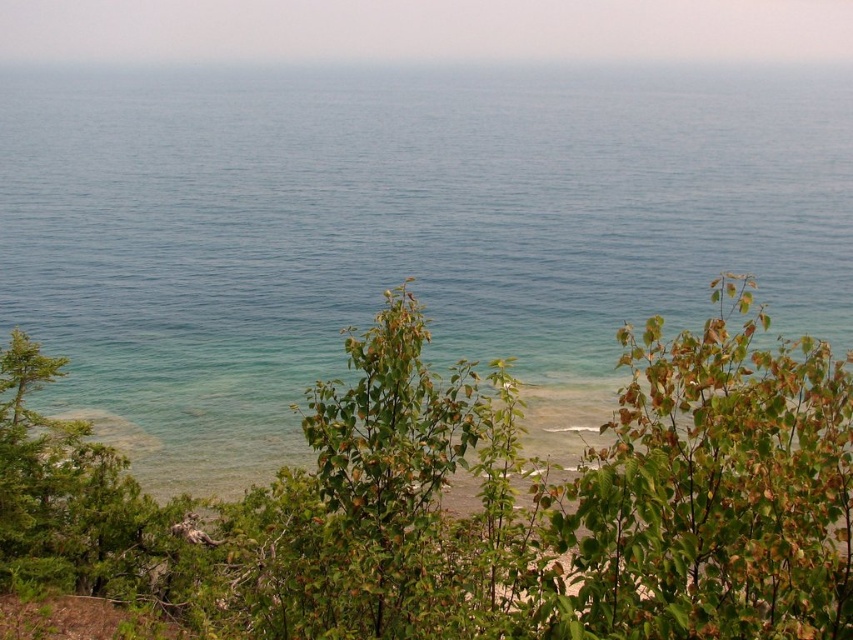
Question: Considering the real-world distances, which object is closest to the clear blue water at center?

Choices:
 (A) green leafy tree at center
 (B) green leafy shrub at center

Answer: (B)

Question: In this image, where is clear blue water at center located relative to green leafy tree at center?

Choices:
 (A) below
 (B) above

Answer: (B)

Question: Can you confirm if clear blue water at center is positioned below green leafy tree at center?

Choices:
 (A) no
 (B) yes

Answer: (A)

Question: Can you confirm if clear blue water at center is positioned to the right of green leafy tree at center?

Choices:
 (A) no
 (B) yes

Answer: (B)

Question: Which point is farther to the camera?

Choices:
 (A) (178, 228)
 (B) (363, 426)
 (C) (556, 529)

Answer: (A)

Question: Which is farther from the green leafy shrub at center?

Choices:
 (A) clear blue water at center
 (B) green leafy tree at center

Answer: (A)